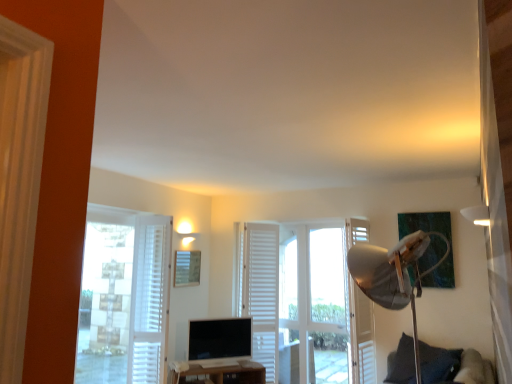
Question: From the image's perspective, is white wooden door at center under white matte lampshade at upper right?

Choices:
 (A) yes
 (B) no

Answer: (A)

Question: Is white wooden door at center outside white matte lampshade at upper right?

Choices:
 (A) yes
 (B) no

Answer: (A)

Question: Is white wooden door at center at the right side of white matte lampshade at upper right?

Choices:
 (A) yes
 (B) no

Answer: (B)

Question: Is white wooden door at center looking in the opposite direction of white matte lampshade at upper right?

Choices:
 (A) yes
 (B) no

Answer: (B)

Question: Does white wooden door at center have a lesser height compared to white matte lampshade at upper right?

Choices:
 (A) no
 (B) yes

Answer: (A)

Question: Is white wooden door at center closer to camera compared to white matte lampshade at upper right?

Choices:
 (A) no
 (B) yes

Answer: (A)

Question: Is wooden picture frame at center wider than white matte curtain at center, the 2th curtain positioned from the front?

Choices:
 (A) yes
 (B) no

Answer: (B)

Question: Is wooden picture frame at center shorter than white matte curtain at center, the second curtain when ordered from left to right?

Choices:
 (A) yes
 (B) no

Answer: (A)

Question: From a real-world perspective, is wooden picture frame at center on white matte curtain at center, the second curtain when ordered from left to right?

Choices:
 (A) no
 (B) yes

Answer: (B)

Question: Is wooden picture frame at center positioned far away from white matte curtain at center, the 2th curtain positioned from the front?

Choices:
 (A) yes
 (B) no

Answer: (B)

Question: Considering the relative positions of wooden picture frame at center and white matte curtain at center, the first curtain positioned from the right, in the image provided, is wooden picture frame at center in front of white matte curtain at center, the first curtain positioned from the right,?

Choices:
 (A) no
 (B) yes

Answer: (A)

Question: From a real-world perspective, is wooden picture frame at center located beneath white matte curtain at center, positioned as the first curtain in back-to-front order?

Choices:
 (A) yes
 (B) no

Answer: (B)

Question: Is wooden picture frame at center positioned beyond the bounds of brown wooden tv stand at lower center?

Choices:
 (A) yes
 (B) no

Answer: (A)